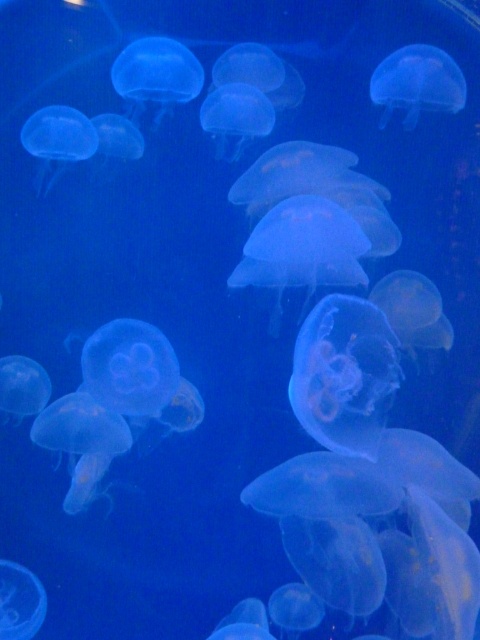
You are an aquarium visitor observing two translucent blue jellyfish in the tank. The first is the translucent blue jellyfish at center, and the second is the translucent blue jellyfish at upper center. From your viewing position, which jellyfish is positioned more to the left?

The translucent blue jellyfish at center is positioned more to the left than the translucent blue jellyfish at upper center.

You are an aquarium staff member checking the tank. You notice two translucent blue jellyfish in the tank. Which one is taller, the translucent blue jellyfish at center or the translucent blue jellyfish at upper center?

The translucent blue jellyfish at center is taller than the translucent blue jellyfish at upper center according to the description.

You are an aquarium visitor standing in front of the tank. You see two translucent blue jellyfish in the tank. Which one is nearer to you, the translucent blue jellyfish at upper right or the translucent blue jellyfish at upper center?

The translucent blue jellyfish at upper right is closer to the viewer than the translucent blue jellyfish at upper center.